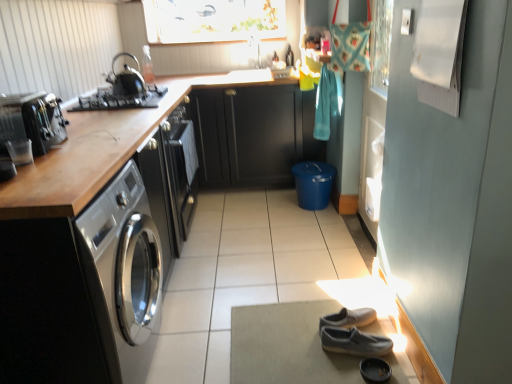
Question: Is black leather shoe at lower center bigger than shiny black kettle at upper left?

Choices:
 (A) yes
 (B) no

Answer: (B)

Question: Does black leather shoe at lower center lie in front of shiny black kettle at upper left?

Choices:
 (A) yes
 (B) no

Answer: (A)

Question: Would you say shiny black kettle at upper left is part of black leather shoe at lower center's contents?

Choices:
 (A) yes
 (B) no

Answer: (B)

Question: Can you confirm if black leather shoe at lower center is shorter than shiny black kettle at upper left?

Choices:
 (A) yes
 (B) no

Answer: (A)

Question: Considering the relative positions of black leather shoe at lower center and shiny black kettle at upper left in the image provided, is black leather shoe at lower center behind shiny black kettle at upper left?

Choices:
 (A) no
 (B) yes

Answer: (A)

Question: Is black leather shoe at lower center not near shiny black kettle at upper left?

Choices:
 (A) no
 (B) yes

Answer: (B)

Question: Does gray suede shoes at lower right appear on the right side of satin black toaster at left?

Choices:
 (A) no
 (B) yes

Answer: (B)

Question: Does gray suede shoes at lower right have a greater width compared to satin black toaster at left?

Choices:
 (A) yes
 (B) no

Answer: (B)

Question: From the image's perspective, is gray suede shoes at lower right under satin black toaster at left?

Choices:
 (A) yes
 (B) no

Answer: (A)

Question: Is satin black toaster at left at the back of gray suede shoes at lower right?

Choices:
 (A) yes
 (B) no

Answer: (B)

Question: Is gray suede shoes at lower right next to satin black toaster at left and touching it?

Choices:
 (A) no
 (B) yes

Answer: (A)

Question: Considering the relative sizes of gray suede shoes at lower right and satin black toaster at left in the image provided, is gray suede shoes at lower right thinner than satin black toaster at left?

Choices:
 (A) no
 (B) yes

Answer: (B)

Question: Is black matte gas stove at upper left at the right side of matte glass window screen at upper center?

Choices:
 (A) no
 (B) yes

Answer: (A)